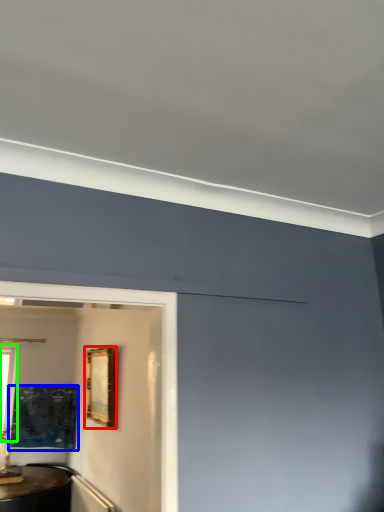
Question: Considering the real-world distances, which object is farthest from picture frame (highlighted by a red box)? picture frame (highlighted by a blue box) or window (highlighted by a green box)?

Choices:
 (A) picture frame
 (B) window

Answer: (B)